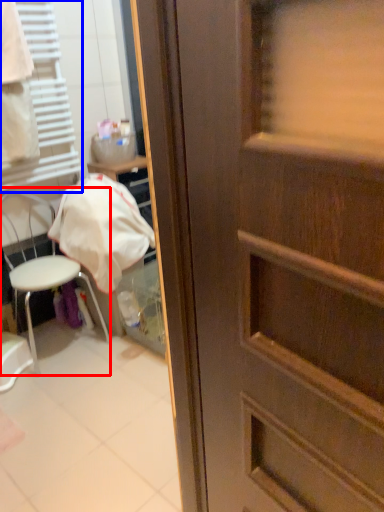
Question: Which point is further to the camera, chair (highlighted by a red box) or shutter (highlighted by a blue box)?

Choices:
 (A) chair
 (B) shutter

Answer: (A)